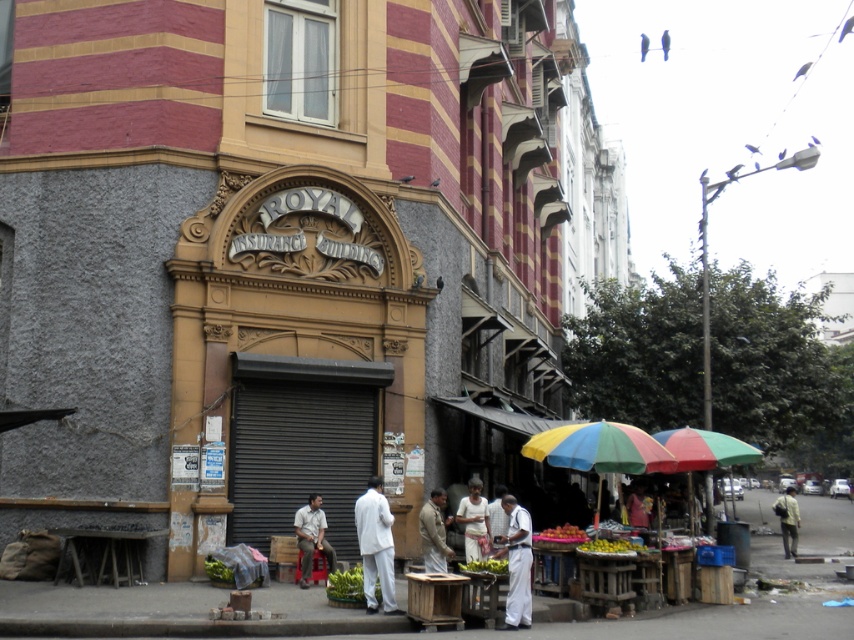
You are a customer looking to buy a fruit. You see a yellow matte fruit at lower center and shiny red apples at lower center. Which fruit is smaller in width?

The yellow matte fruit at lower center has a lesser width compared to shiny red apples at lower center, so the yellow matte fruit at lower center is smaller in width.

You are a pedestrian standing in front of the building and see the rainbow fabric umbrella at center and the light brown leather jacket at center. Which object is positioned to the right of the other?

The rainbow fabric umbrella at center is to the right of the light brown leather jacket at center.

You are a pedestrian walking on the street in front of the building. You see a rainbow fabric umbrella at center and a light brown leather jacket at center. Which object is above the other?

The rainbow fabric umbrella at center is positioned over the light brown leather jacket at center, so the umbrella is above the jacket.